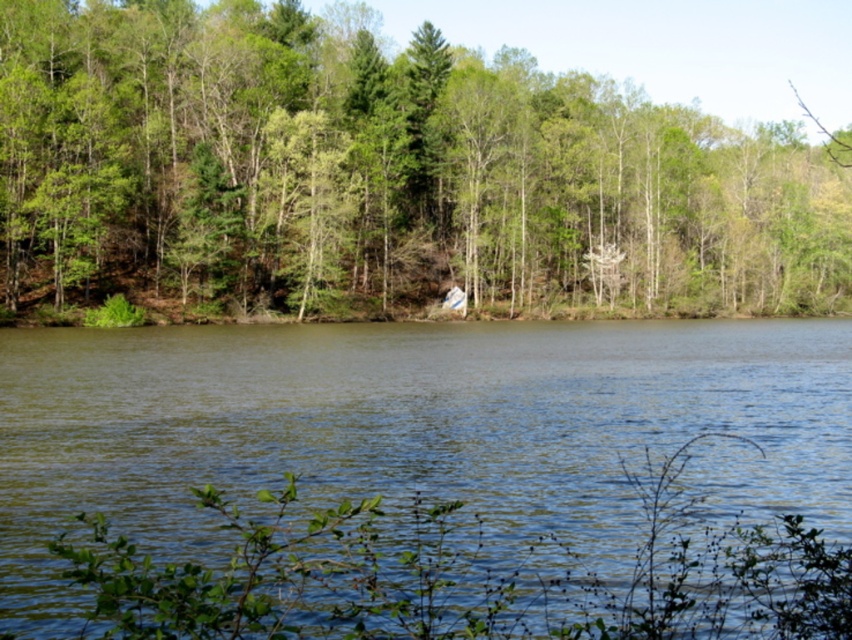
You are standing at the edge of the forest and see the green leafy tree at center and the greenish water at center. Which object is closer to you?

The green leafy tree at center is closer to you because it is positioned over the greenish water at center, indicating it is in front of the water.

Looking at this image, you are standing at the point with coordinates point (x=380, y=173) in the image. What object is directly in front of you?

The point (x=380, y=173) corresponds to the green leafy tree at center.